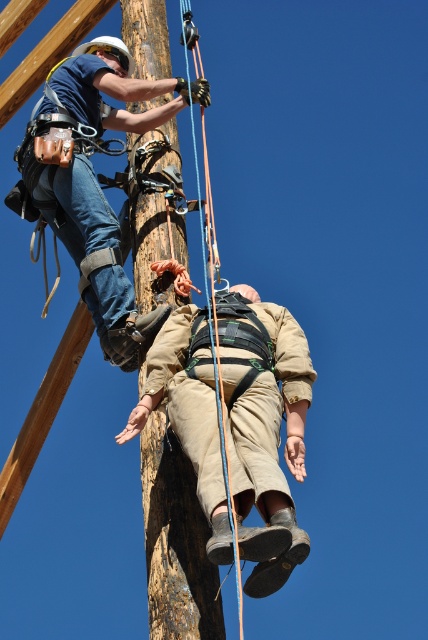
Question: Which of these objects is positioned farthest from the tan canvas pants at lower center?

Choices:
 (A) blue synthetic rope at center
 (B) matte blue shirt at upper left
 (C) brown rough wood pole at center

Answer: (A)

Question: Where is brown rough wood pole at center located in relation to blue synthetic rope at center in the image?

Choices:
 (A) left
 (B) right

Answer: (A)

Question: Considering the real-world distances, which object is farthest from the brown rough wood pole at center?

Choices:
 (A) blue synthetic rope at center
 (B) matte blue shirt at upper left
 (C) tan canvas pants at lower center

Answer: (A)

Question: Does tan canvas pants at lower center lie behind blue synthetic rope at center?

Choices:
 (A) yes
 (B) no

Answer: (A)

Question: Can you confirm if matte blue shirt at upper left is positioned below brown rough wood pole at center?

Choices:
 (A) no
 (B) yes

Answer: (A)

Question: Among these points, which one is nearest to the camera?

Choices:
 (A) (148, 477)
 (B) (234, 449)
 (C) (190, 115)
 (D) (53, 186)

Answer: (B)